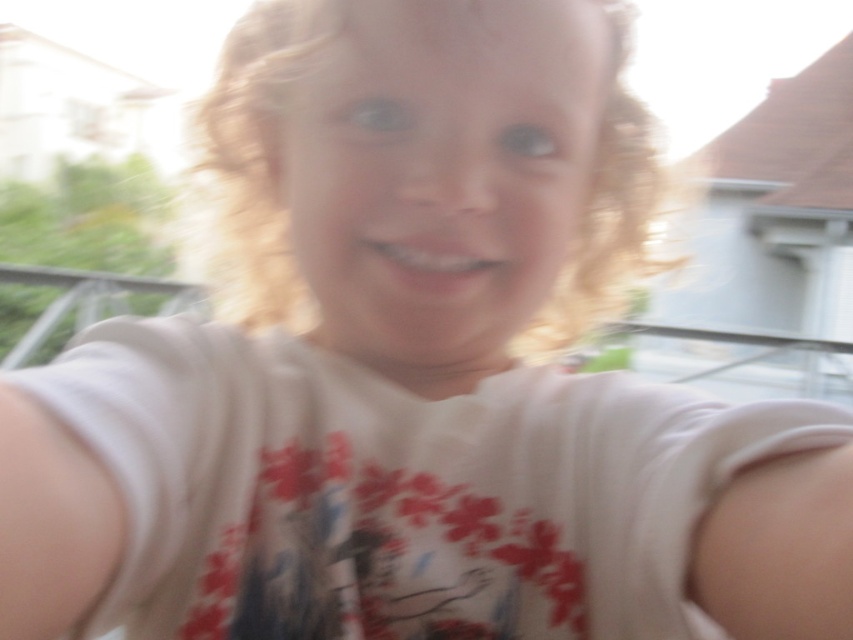
Is blonde curly hair at center above smooth matte teeth at center?

Indeed, blonde curly hair at center is positioned over smooth matte teeth at center.

Who is more forward, (645, 184) or (431, 260)?

Point (431, 260) is in front.

Identify the location of blonde curly hair at center. This screenshot has height=640, width=853. (259, 156).